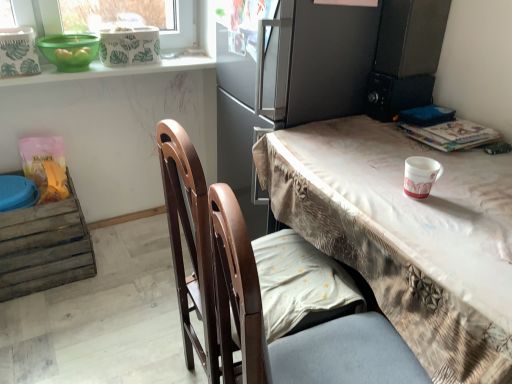
This screenshot has width=512, height=384. What are the coordinates of `empty space that is to the right of weathered wood crate at lower left` in the screenshot? It's located at (122, 270).